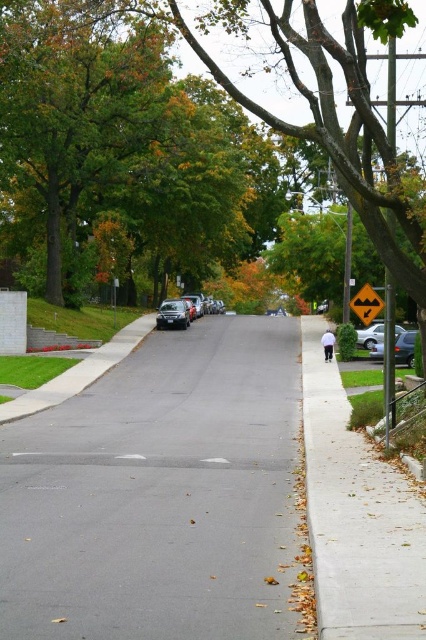
Question: Does shiny silver sedan at center appear under yellow reflective plastic triangle at right?

Choices:
 (A) no
 (B) yes

Answer: (A)

Question: Does gray asphalt road at center come behind yellow reflective plastic triangle at right?

Choices:
 (A) yes
 (B) no

Answer: (B)

Question: Which object appears farthest from the camera in this image?

Choices:
 (A) gray asphalt road at center
 (B) shiny silver sedan at center
 (C) shiny black sedan at center
 (D) metallic silver sedan at right

Answer: (B)

Question: Which of these objects is positioned farthest from the metallic silver sedan at right?

Choices:
 (A) silver metallic sedan at right
 (B) gray concrete sidewalk at right
 (C) shiny silver sedan at center
 (D) gray asphalt road at center

Answer: (C)

Question: Can you confirm if metallic silver sedan at right is positioned to the right of yellow reflective plastic triangle at right?

Choices:
 (A) yes
 (B) no

Answer: (B)

Question: Which point is closer to the camera taking this photo?

Choices:
 (A) (382, 300)
 (B) (365, 348)
 (C) (310, 468)
 (D) (333, 99)

Answer: (C)